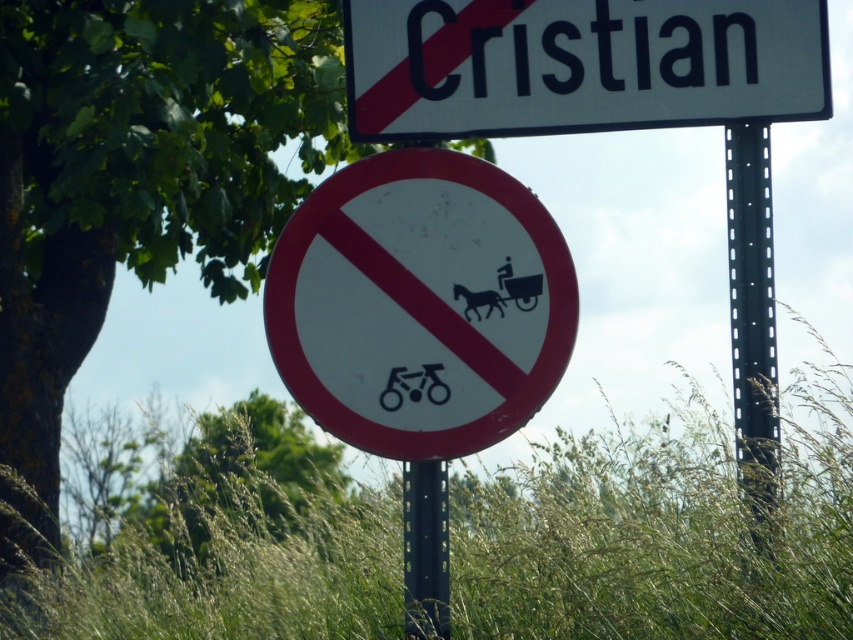
You are a cyclist approaching the black metal pole at right and the black metal pole at center. Which pole is wider?

The black metal pole at right is wider than the black metal pole at center.